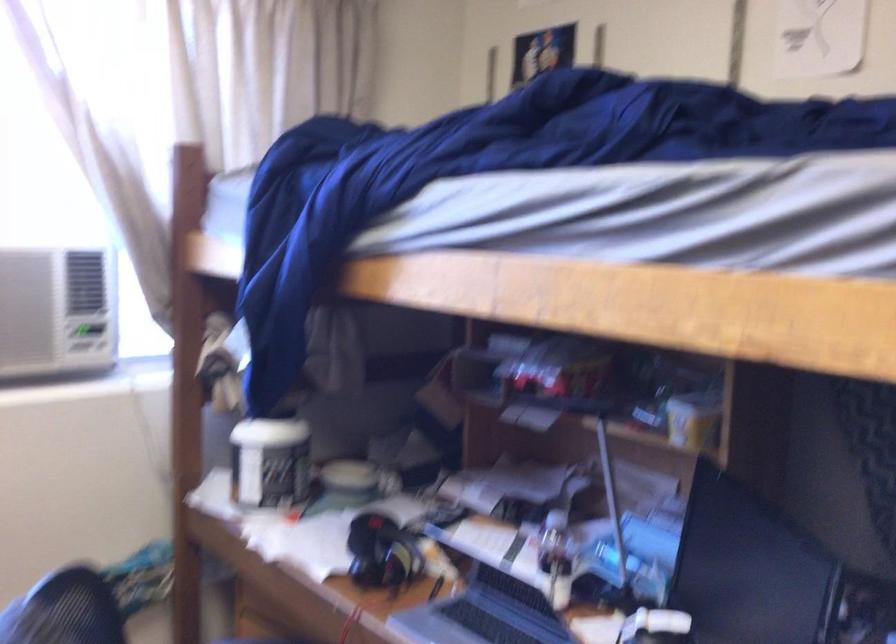
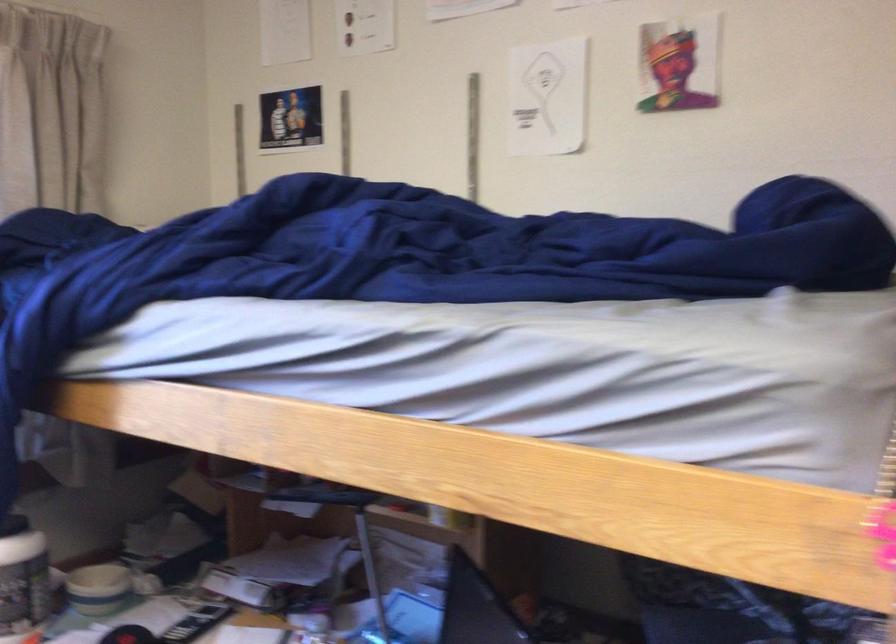
Question: In a continuous first-person perspective shot, in which direction is the camera moving?

Choices:
 (A) Left
 (B) Right
 (C) Forward
 (D) Backward

Answer: (B)